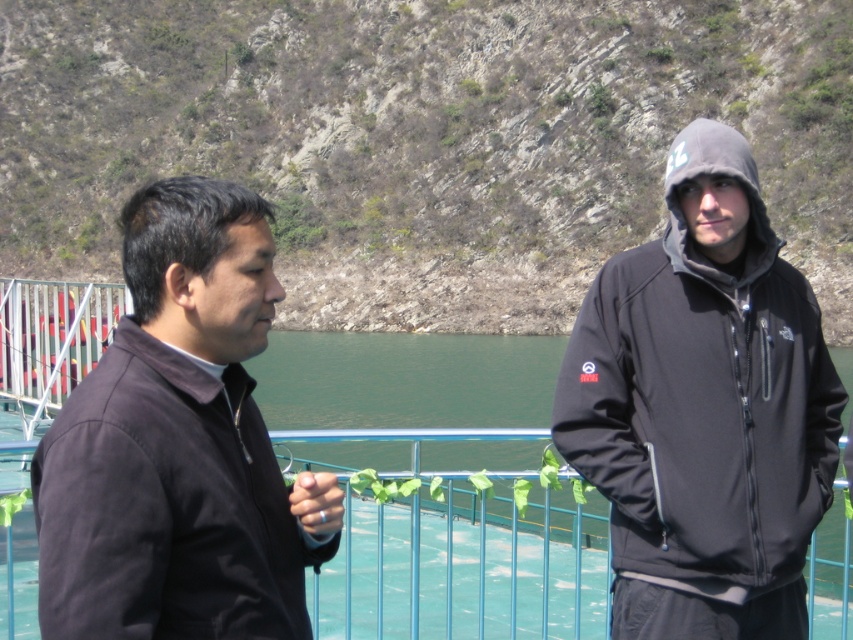
You are a photographer trying to capture a photo of the matte black hoodie at right and the dark matte jacket at left. Since you want to ensure both subjects are in focus, you need to know their vertical positions. Which one is positioned higher from the ground?

The matte black hoodie at right is located above the dark matte jacket at left, so it is positioned higher from the ground.

You are a photographer trying to capture a group photo of the matte black hoodie at right and the dark matte jacket at left. Since you want them to face the same direction, which person should move to the left to align their positions?

The matte black hoodie at right should move to the left to align their positions because it is currently positioned on the right side of the dark matte jacket at left.